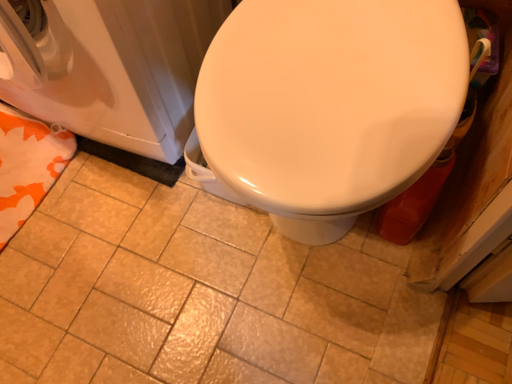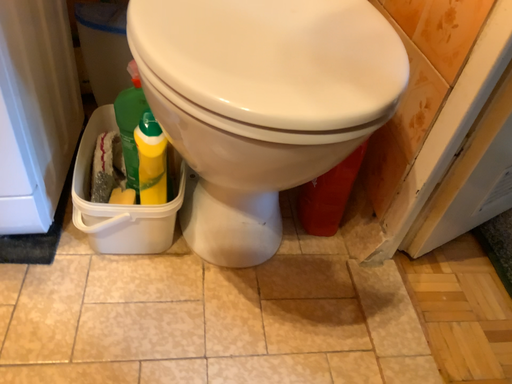
Question: Which way did the camera rotate in the video?

Choices:
 (A) rotated upward
 (B) rotated downward

Answer: (A)